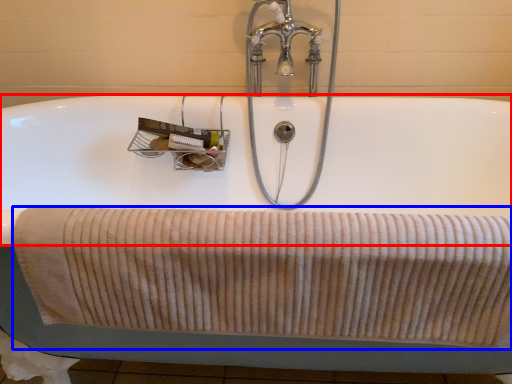
Question: Which point is further to the camera, bath (highlighted by a red box) or bath towel (highlighted by a blue box)?

Choices:
 (A) bath
 (B) bath towel

Answer: (A)